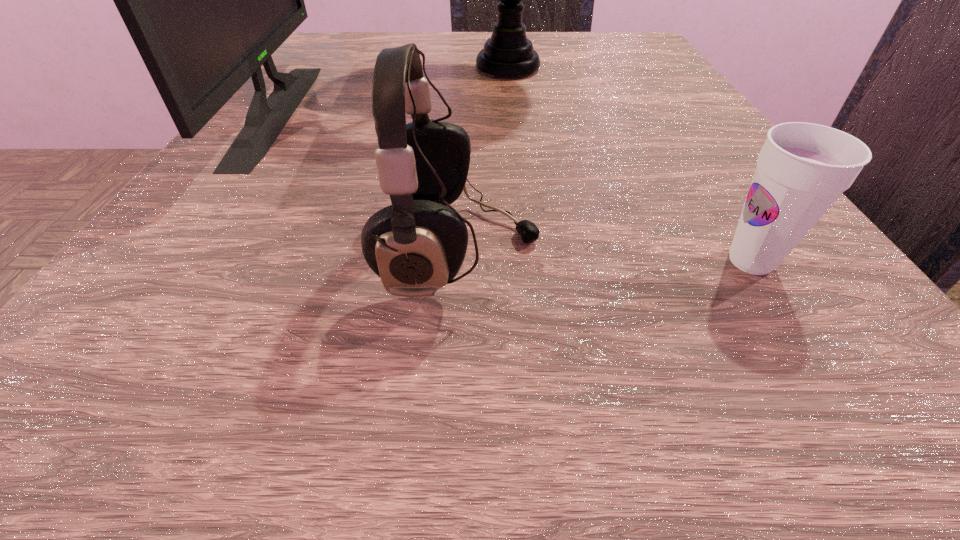
I want to click on lamp located in the far edge section of the desktop, so click(x=508, y=52).

Image resolution: width=960 pixels, height=540 pixels. Identify the location of monitor located at the far edge. (207, 0).

I want to click on object located at the left edge, so click(207, 0).

This screenshot has height=540, width=960. Identify the location of lamp located in the right edge section of the desktop. (x=508, y=52).

At what (x,y) coordinates should I click in order to perform the action: click on cup positioned at the right edge. Please return your answer as a coordinate pair (x, y). Image resolution: width=960 pixels, height=540 pixels. Looking at the image, I should click on (802, 169).

Where is `object present at the far left corner`? object present at the far left corner is located at coordinates (207, 0).

The image size is (960, 540). Find the location of `object located at the far right corner`. object located at the far right corner is located at coordinates (508, 52).

At what (x,y) coordinates should I click in order to perform the action: click on vacant space at the far edge of the desktop. Please return your answer as a coordinate pair (x, y). This screenshot has height=540, width=960. Looking at the image, I should click on (560, 53).

Where is `vacant space at the near edge`? This screenshot has width=960, height=540. vacant space at the near edge is located at coordinates (530, 364).

Identify the location of vacant space at the left edge of the desktop. (221, 231).